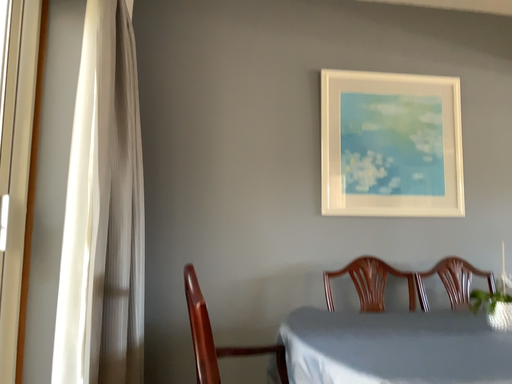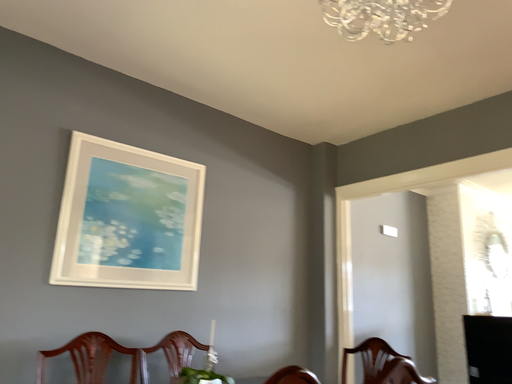
Question: Which way did the camera rotate in the video?

Choices:
 (A) rotated left
 (B) rotated right

Answer: (B)